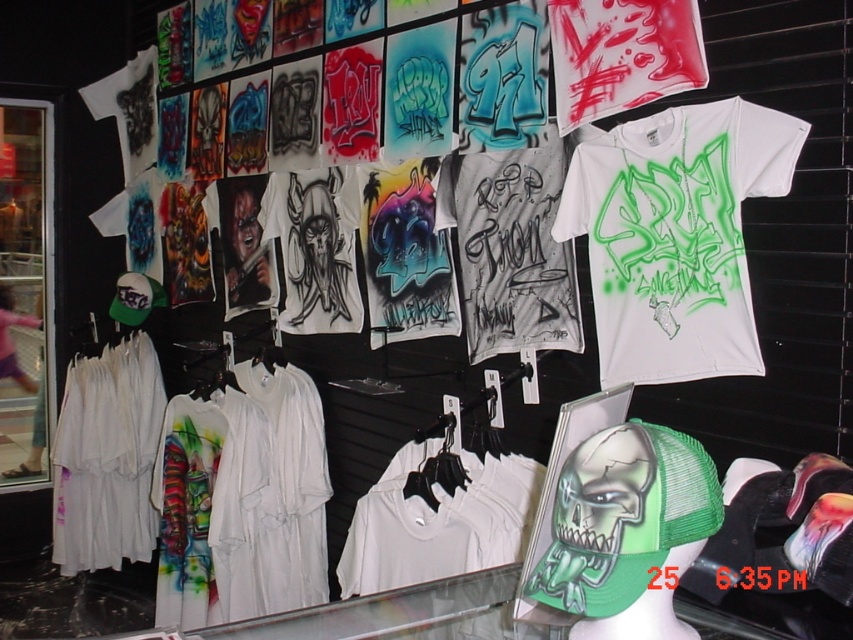
Question: In this image, where is white matte t-shirt at right located relative to white cotton t-shirt at left?

Choices:
 (A) left
 (B) right

Answer: (B)

Question: Which point appears farthest from the camera in this image?

Choices:
 (A) (74, 378)
 (B) (20, 317)
 (C) (409, 582)

Answer: (B)

Question: Which point is farther from the camera taking this photo?

Choices:
 (A) (621, 225)
 (B) (422, 513)
 (C) (94, 554)

Answer: (C)

Question: Estimate the real-world distances between objects in this image. Which object is closer to the white cotton t-shirt at left?

Choices:
 (A) white matte t-shirt at right
 (B) white cotton t-shirt at center
 (C) transparent glass door at left
 (D) white cotton shirts at left

Answer: (C)

Question: From the image, what is the correct spatial relationship of white matte t-shirt at right in relation to white cotton t-shirt at center?

Choices:
 (A) left
 (B) right

Answer: (B)

Question: Can you confirm if white matte t-shirt at right is wider than white cotton t-shirt at left?

Choices:
 (A) no
 (B) yes

Answer: (B)